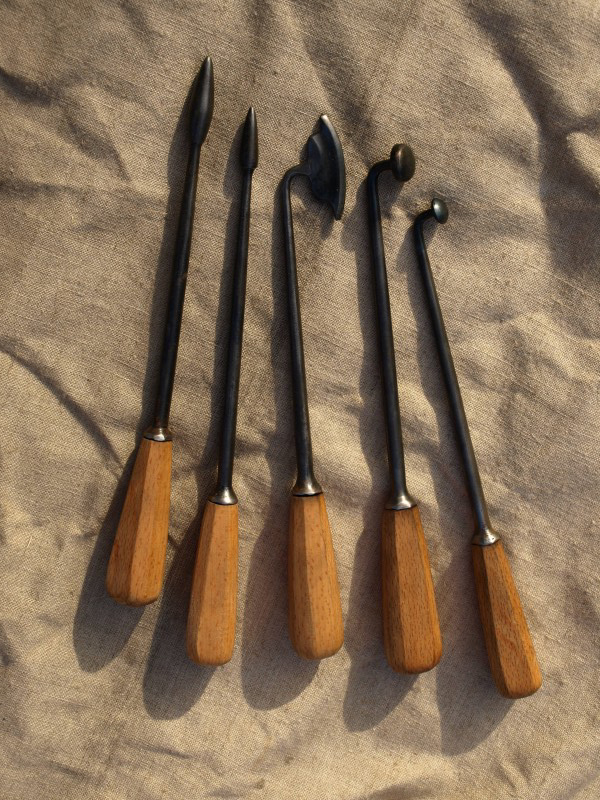
The height and width of the screenshot is (800, 600). Identify the location of sunlight hitting the linen sheets. (x=508, y=278).